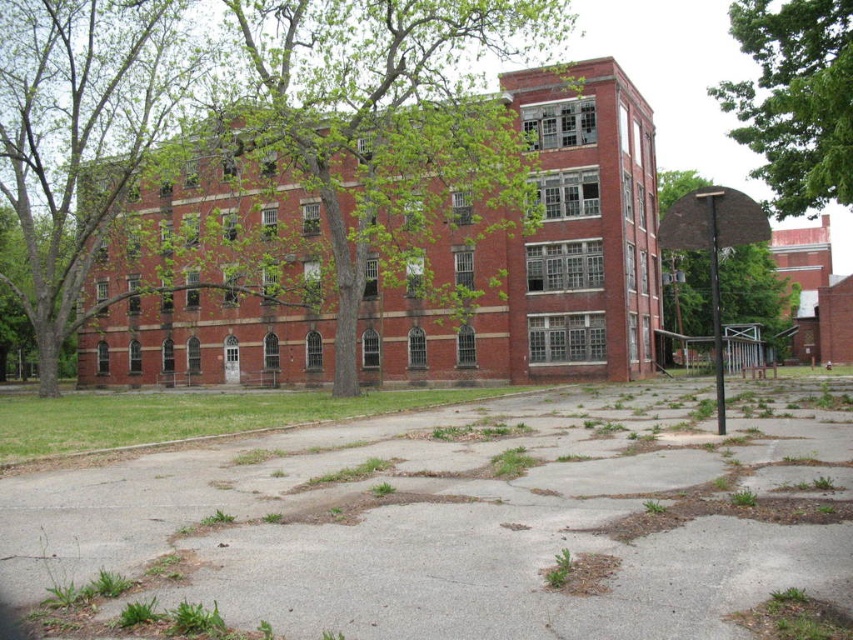
Question: Does green leafy tree at upper center lie behind brown textured basketball hoop at center right?

Choices:
 (A) no
 (B) yes

Answer: (B)

Question: Can you confirm if green leafy tree at upper center is positioned to the left of brown textured basketball hoop at center right?

Choices:
 (A) no
 (B) yes

Answer: (A)

Question: Does green leafy tree at upper center have a smaller size compared to brown textured basketball hoop at center right?

Choices:
 (A) yes
 (B) no

Answer: (B)